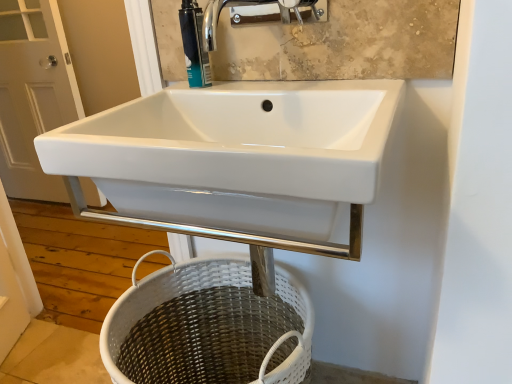
Question: In the image, is chrome metallic faucet at upper center positioned in front of or behind white glossy sink at center?

Choices:
 (A) behind
 (B) front

Answer: (A)

Question: Is chrome metallic faucet at upper center inside or outside of white glossy sink at center?

Choices:
 (A) outside
 (B) inside

Answer: (A)

Question: Which object is the farthest from the white glossy sink at center?

Choices:
 (A) white woven basket at lower center
 (B) white glossy door at left
 (C) chrome metallic faucet at upper center
 (D) teal plastic soap dispenser at upper center

Answer: (B)

Question: Which is farther from the white glossy door at left?

Choices:
 (A) white woven basket at lower center
 (B) teal plastic soap dispenser at upper center
 (C) chrome metallic faucet at upper center
 (D) white glossy sink at center

Answer: (D)